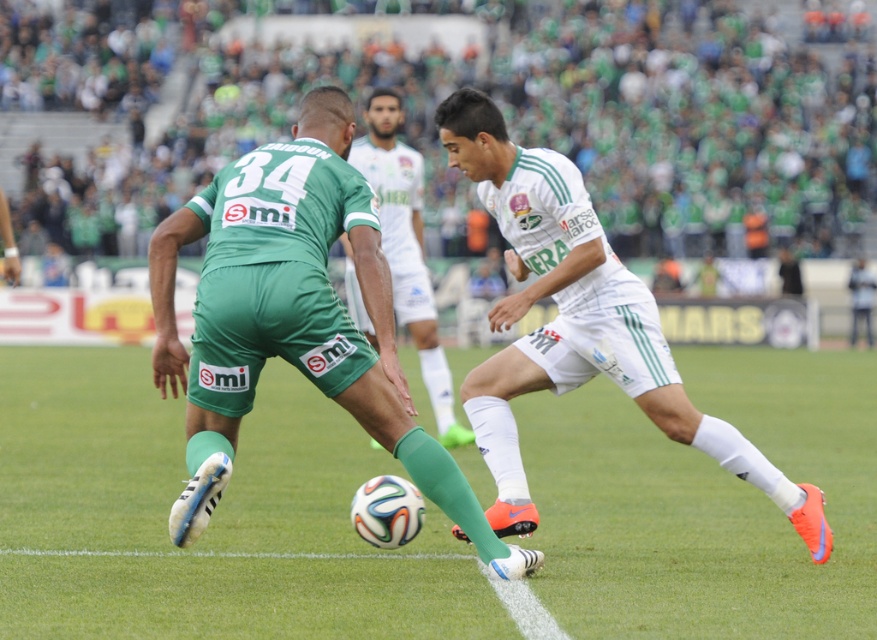
You are a soccer referee observing the match. You need to determine if the ball is within the field boundaries. The ball is currently near the white matte shorts at center. Based on the scene, is the ball inside the green grass football field at center?

The green grass football field at center is positioned on the right side of white matte shorts at center, so the ball near the white matte shorts at center is within the green grass football field at center.

You are a soccer coach analyzing the field layout. The green grass football field at center and the white matte shorts at center are both visible. Which one is wider?

The green grass football field at center is wider than the white matte shorts at center because its width surpasses the shorts.